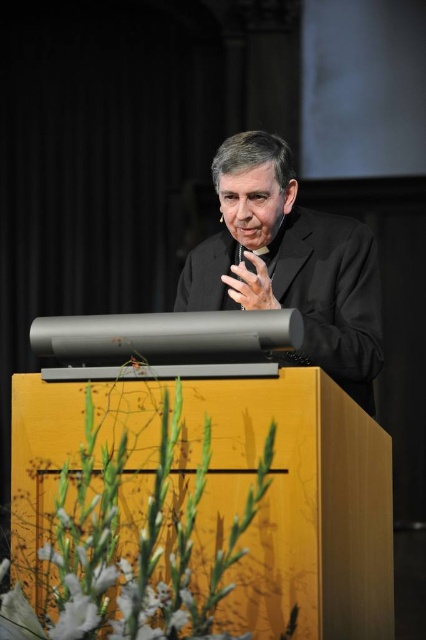
Question: Is yellow wood podium at center below black matte suit at center?

Choices:
 (A) no
 (B) yes

Answer: (B)

Question: Does yellow wood podium at center appear under black matte suit at center?

Choices:
 (A) yes
 (B) no

Answer: (A)

Question: Does yellow wood podium at center appear under black matte suit at center?

Choices:
 (A) yes
 (B) no

Answer: (A)

Question: Which point is farther to the camera?

Choices:
 (A) (216, 266)
 (B) (278, 388)

Answer: (A)